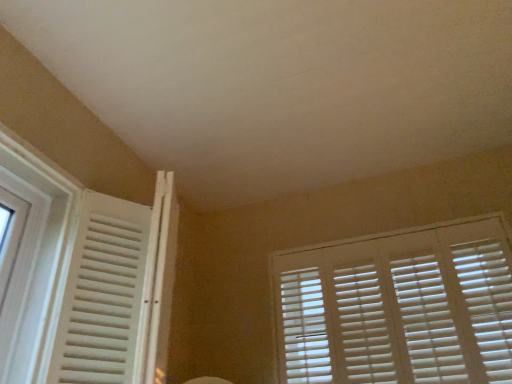
Question: Looking at their shapes, would you say white wooden window at left is wider or thinner than white matte window blind at upper right?

Choices:
 (A) wide
 (B) thin

Answer: (A)

Question: Is white wooden window at left taller or shorter than white matte window blind at upper right?

Choices:
 (A) tall
 (B) short

Answer: (A)

Question: Does point (141, 240) appear closer or farther from the camera than point (313, 286)?

Choices:
 (A) closer
 (B) farther

Answer: (A)

Question: Is point (468, 322) closer or farther from the camera than point (142, 352)?

Choices:
 (A) closer
 (B) farther

Answer: (B)

Question: From the image's perspective, is white matte window blind at upper right positioned above or below white wooden window at left?

Choices:
 (A) below
 (B) above

Answer: (A)

Question: Is white matte window blind at upper right in front of or behind white wooden window at left in the image?

Choices:
 (A) front
 (B) behind

Answer: (B)

Question: Considering the positions of white matte window blind at upper right and white wooden window at left in the image, is white matte window blind at upper right wider or thinner than white wooden window at left?

Choices:
 (A) thin
 (B) wide

Answer: (A)